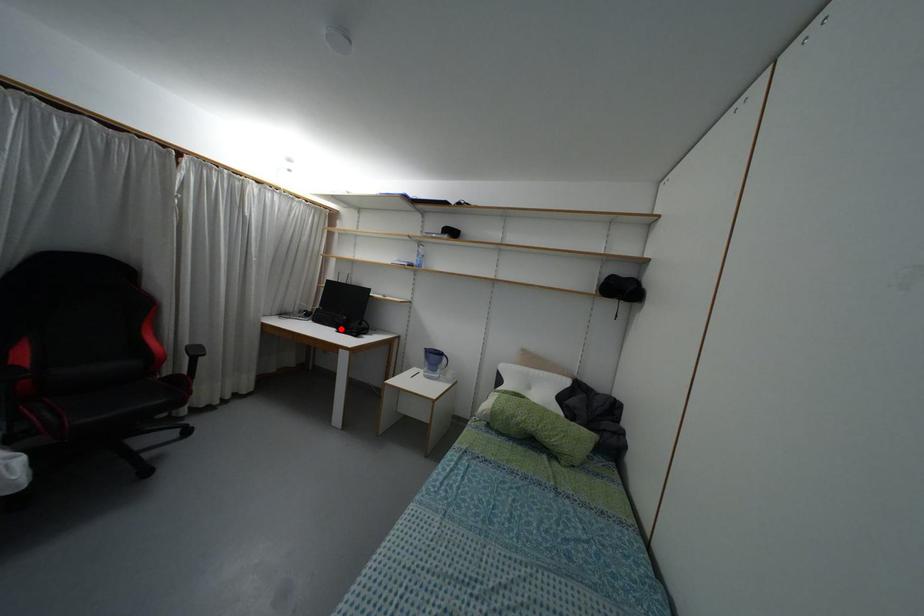
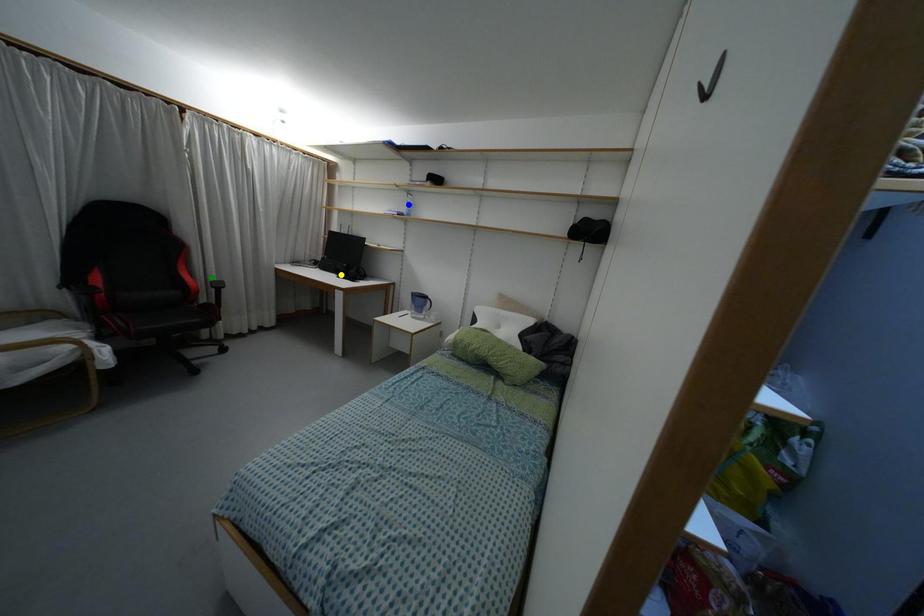
Question: I am providing you with two images of the same scene from different viewpoints. A red point is marked on the first image. You are given multiple points on the second image. Can you choose the point in image 2 that corresponds to the point in image 1?

Choices:
 (A) yellow point
 (B) green point
 (C) blue point

Answer: (A)